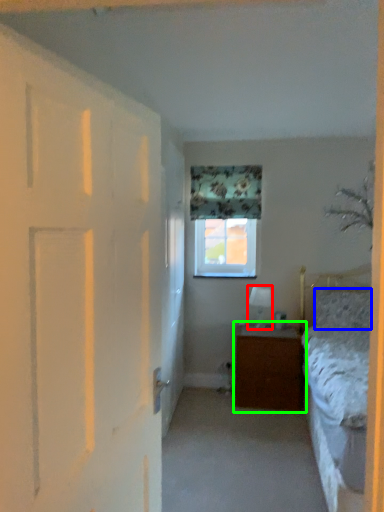
Question: Estimate the real-world distances between objects in this image. Which object is closer to lamp (highlighted by a red box), pillow (highlighted by a blue box) or nightstand (highlighted by a green box)?

Choices:
 (A) pillow
 (B) nightstand

Answer: (B)